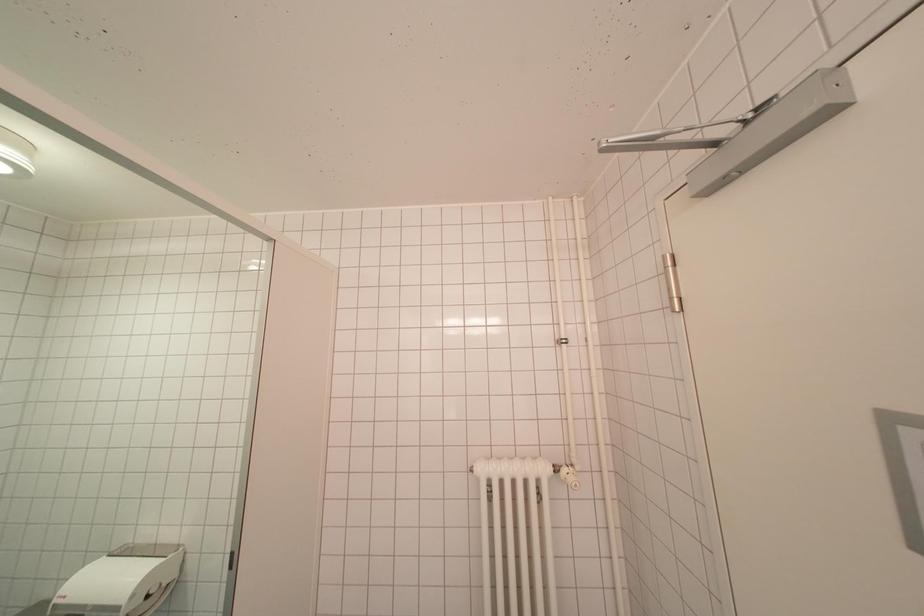
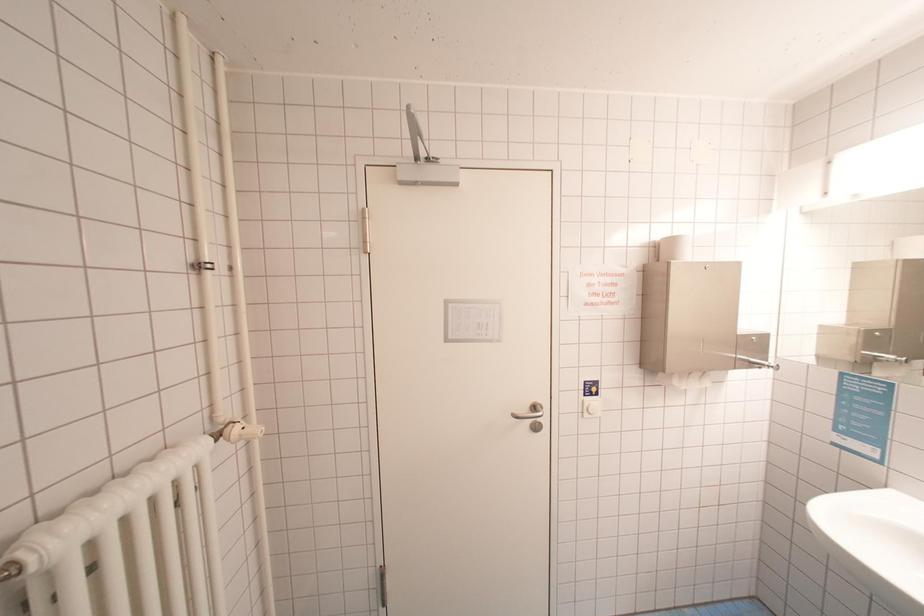
Question: The first image is from the beginning of the video and the second image is from the end. How did the camera likely rotate when shooting the video?

Choices:
 (A) Left
 (B) Right
 (C) Up
 (D) Down

Answer: (B)